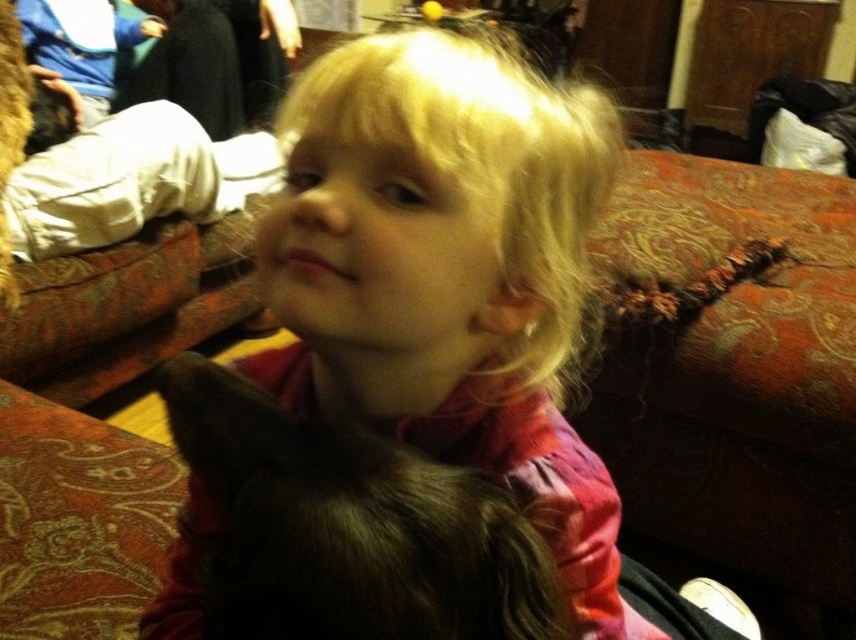
Question: Which object is closer to the camera taking this photo?

Choices:
 (A) smooth pink shirt at center
 (B) dark fur cat at center

Answer: (B)

Question: Is smooth pink shirt at center to the left of dark fur cat at center from the viewer's perspective?

Choices:
 (A) yes
 (B) no

Answer: (B)

Question: Is smooth pink shirt at center below dark fur cat at center?

Choices:
 (A) no
 (B) yes

Answer: (B)

Question: Which of the following is the farthest from the observer?

Choices:
 (A) (391, 621)
 (B) (390, 330)

Answer: (B)

Question: Considering the relative positions of smooth pink shirt at center and dark fur cat at center in the image provided, where is smooth pink shirt at center located with respect to dark fur cat at center?

Choices:
 (A) below
 (B) above

Answer: (A)